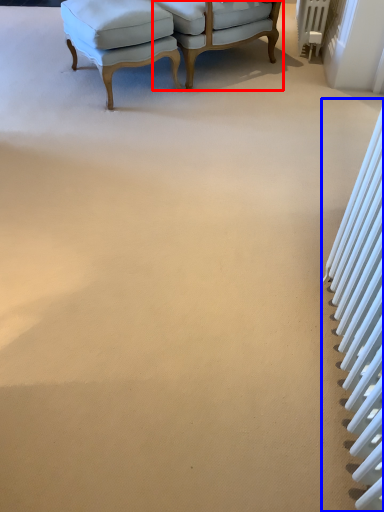
Question: Which point is further to the camera, chair (highlighted by a red box) or radiator (highlighted by a blue box)?

Choices:
 (A) chair
 (B) radiator

Answer: (A)